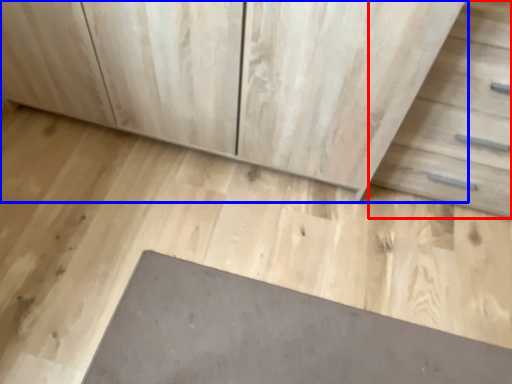
Question: Among these objects, which one is farthest to the camera, drawer (highlighted by a red box) or chest of drawers (highlighted by a blue box)?

Choices:
 (A) drawer
 (B) chest of drawers

Answer: (B)